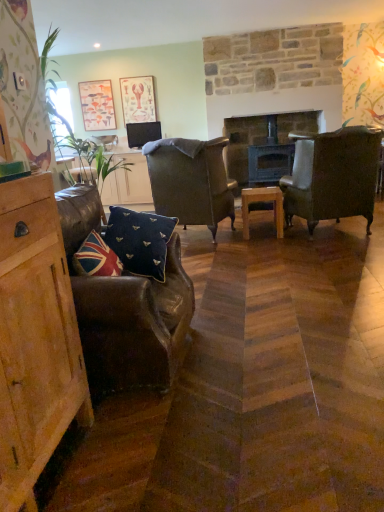
Question: Which direction should I rotate to face navy velvet cushion at center, which is counted as the 1th pillow, starting from the back, — up or down?

Choices:
 (A) up
 (B) down

Answer: (A)

Question: Is dark wood fireplace at center to the right of leather armchair at left, which ranks as the 1th chair in front-to-back order, from the viewer's perspective?

Choices:
 (A) no
 (B) yes

Answer: (B)

Question: Is dark wood fireplace at center not close to leather armchair at left, which ranks as the 1th chair in front-to-back order?

Choices:
 (A) yes
 (B) no

Answer: (A)

Question: Does dark wood fireplace at center have a smaller size compared to leather armchair at left, marked as the 1th chair in a left-to-right arrangement?

Choices:
 (A) yes
 (B) no

Answer: (A)

Question: Is dark wood fireplace at center to the left of leather armchair at left, positioned as the 3th chair in right-to-left order, from the viewer's perspective?

Choices:
 (A) yes
 (B) no

Answer: (B)

Question: Is dark wood fireplace at center shorter than leather armchair at left, acting as the third chair starting from the back?

Choices:
 (A) yes
 (B) no

Answer: (B)

Question: Is leather armchair at left, acting as the third chair starting from the back, at the back of dark wood fireplace at center?

Choices:
 (A) no
 (B) yes

Answer: (A)

Question: Considering the relative sizes of wooden picture frame at upper left, placed as the first picture frame when sorted from left to right, and matte black tv at center in the image provided, is wooden picture frame at upper left, placed as the first picture frame when sorted from left to right, thinner than matte black tv at center?

Choices:
 (A) no
 (B) yes

Answer: (B)

Question: Is wooden picture frame at upper left, placed as the first picture frame when sorted from left to right, not inside matte black tv at center?

Choices:
 (A) no
 (B) yes

Answer: (B)

Question: Could you tell me if wooden picture frame at upper left, placed as the first picture frame when sorted from left to right, is facing matte black tv at center?

Choices:
 (A) no
 (B) yes

Answer: (A)

Question: Does wooden picture frame at upper left, placed as the first picture frame when sorted from left to right, have a larger size compared to matte black tv at center?

Choices:
 (A) yes
 (B) no

Answer: (B)

Question: Can you confirm if wooden picture frame at upper left, the second picture frame when ordered from right to left, is wider than matte black tv at center?

Choices:
 (A) no
 (B) yes

Answer: (A)

Question: Does wooden picture frame at upper left, placed as the first picture frame when sorted from left to right, come in front of matte black tv at center?

Choices:
 (A) no
 (B) yes

Answer: (A)

Question: From the image's perspective, is wooden table at center on top of green leafy plant at left?

Choices:
 (A) no
 (B) yes

Answer: (A)